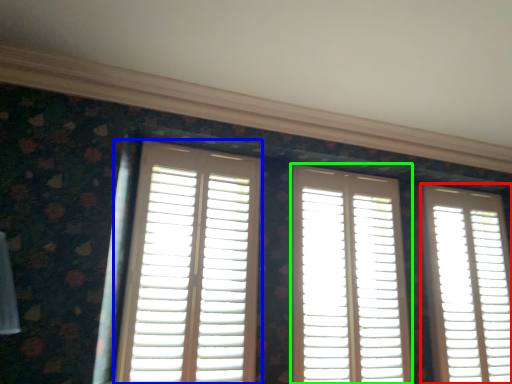
Question: Which object is the closest to the window (highlighted by a red box)? Choose among these: window (highlighted by a blue box) or window (highlighted by a green box).

Choices:
 (A) window
 (B) window

Answer: (B)